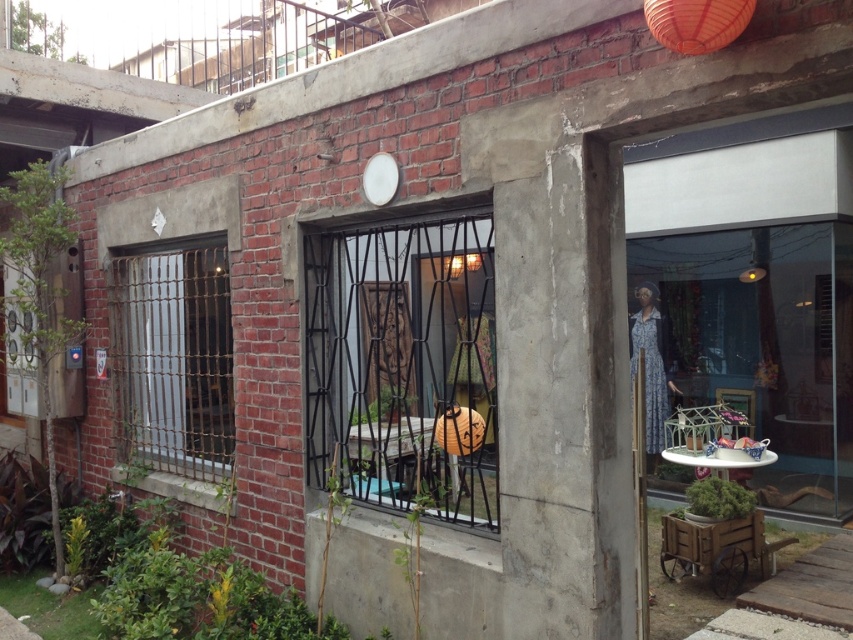
Question: Which point is farther to the camera?

Choices:
 (A) orange paper lantern at center
 (B) orange matte paper lantern at upper center
 (C) black metal gate at center

Answer: (C)

Question: Is orange matte paper lantern at upper center thinner than orange paper lantern at center?

Choices:
 (A) no
 (B) yes

Answer: (B)

Question: Is black metal gate at center wider than orange paper lantern at center?

Choices:
 (A) no
 (B) yes

Answer: (B)

Question: Among these points, which one is nearest to the camera?

Choices:
 (A) (708, 8)
 (B) (461, 308)

Answer: (A)

Question: Which of these objects is positioned closest to the orange paper lantern at center?

Choices:
 (A) orange matte paper lantern at upper center
 (B) black metal gate at center

Answer: (B)

Question: Is black metal gate at center in front of orange paper lantern at center?

Choices:
 (A) yes
 (B) no

Answer: (B)